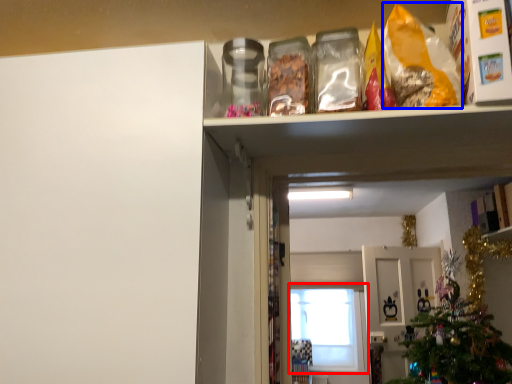
Question: Which point is further to the camera, window (highlighted by a red box) or cereal (highlighted by a blue box)?

Choices:
 (A) window
 (B) cereal

Answer: (A)